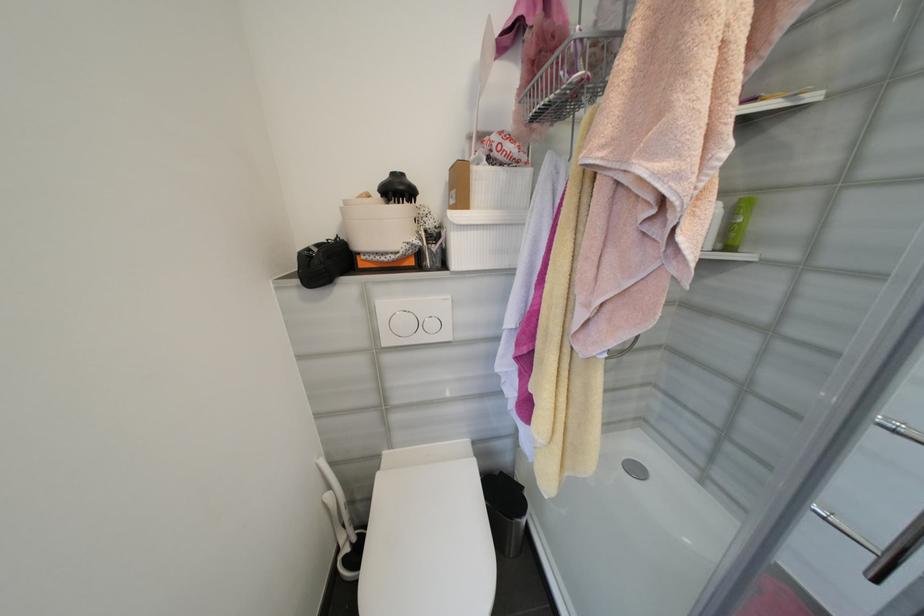
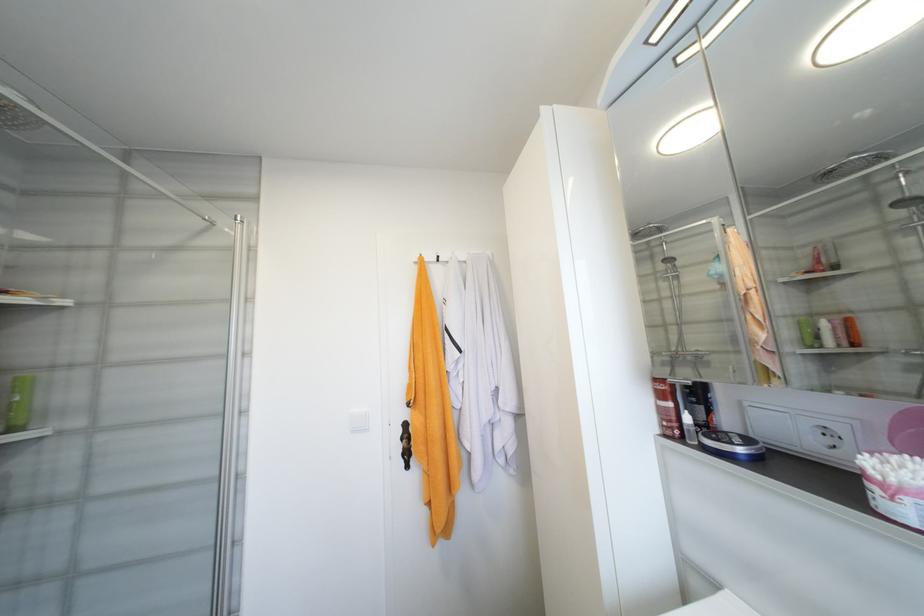
Find the pixel in the second image that matches the point at 733,249 in the first image.

(19, 430)